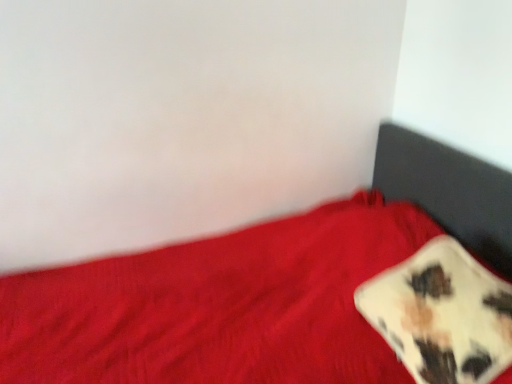
Question: Is red fabric bed at lower right taller or shorter than cow print fabric pillow at lower right?

Choices:
 (A) tall
 (B) short

Answer: (A)

Question: From a real-world perspective, is red fabric bed at lower right positioned above or below cow print fabric pillow at lower right?

Choices:
 (A) below
 (B) above

Answer: (A)

Question: From the image's perspective, relative to cow print fabric pillow at lower right, is red fabric bed at lower right above or below?

Choices:
 (A) below
 (B) above

Answer: (A)

Question: In terms of width, does cow print fabric pillow at lower right look wider or thinner when compared to red fabric bed at lower right?

Choices:
 (A) thin
 (B) wide

Answer: (A)

Question: Does point (466, 319) appear closer or farther from the camera than point (408, 160)?

Choices:
 (A) farther
 (B) closer

Answer: (B)

Question: From the image's perspective, is cow print fabric pillow at lower right located above or below red fabric bed at lower right?

Choices:
 (A) above
 (B) below

Answer: (A)

Question: Considering the positions of cow print fabric pillow at lower right and red fabric bed at lower right in the image, is cow print fabric pillow at lower right bigger or smaller than red fabric bed at lower right?

Choices:
 (A) big
 (B) small

Answer: (B)